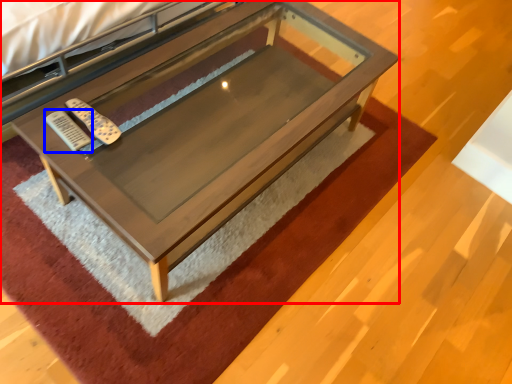
Question: Which object is closer to the camera taking this photo, table (highlighted by a red box) or remote (highlighted by a blue box)?

Choices:
 (A) table
 (B) remote

Answer: (A)